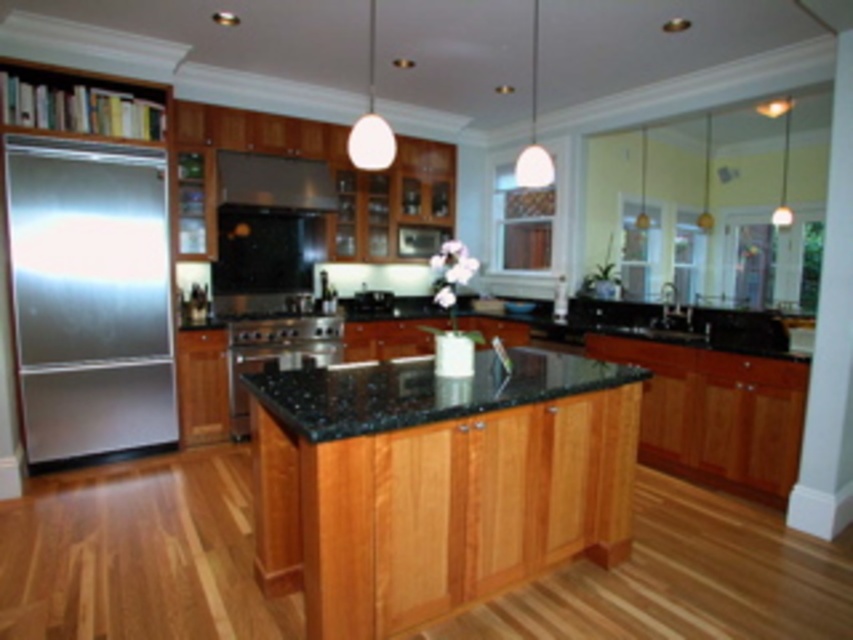
Measure the distance between black granite oven at center and black granite sink at center.

A distance of 5.02 feet exists between black granite oven at center and black granite sink at center.

Does black granite oven at center have a smaller size compared to black granite sink at center?

Yes.

The image size is (853, 640). What are the coordinates of `black granite oven at center` in the screenshot? It's located at (276, 353).

The height and width of the screenshot is (640, 853). Find the location of `black granite oven at center`. black granite oven at center is located at coordinates (276, 353).

Does satin black exhaust hood at upper center have a larger size compared to black granite sink at center?

Incorrect, satin black exhaust hood at upper center is not larger than black granite sink at center.

From the picture: Between satin black exhaust hood at upper center and black granite sink at center, which one is positioned higher?

satin black exhaust hood at upper center

Describe the element at coordinates (274, 180) in the screenshot. I see `satin black exhaust hood at upper center` at that location.

I want to click on satin black exhaust hood at upper center, so click(274, 180).

In the scene shown: Which is above, natural wood island at center or satin black exhaust hood at upper center?

satin black exhaust hood at upper center is above.

Is point (318, 477) positioned before point (260, 170)?

That is True.

Does point (535, 490) lie behind point (221, 180)?

That is False.

The width and height of the screenshot is (853, 640). I want to click on natural wood island at center, so click(434, 481).